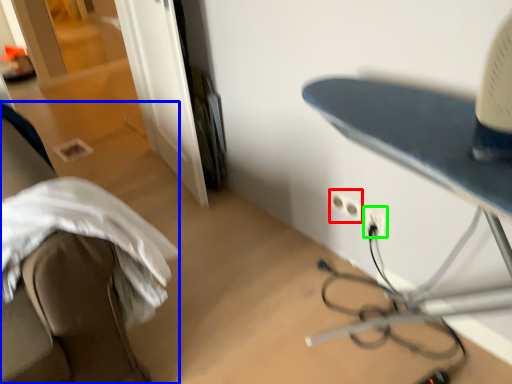
Question: Estimate the real-world distances between objects in this image. Which object is farther from electric outlet (highlighted by a red box), furniture (highlighted by a blue box) or electric outlet (highlighted by a green box)?

Choices:
 (A) furniture
 (B) electric outlet

Answer: (A)